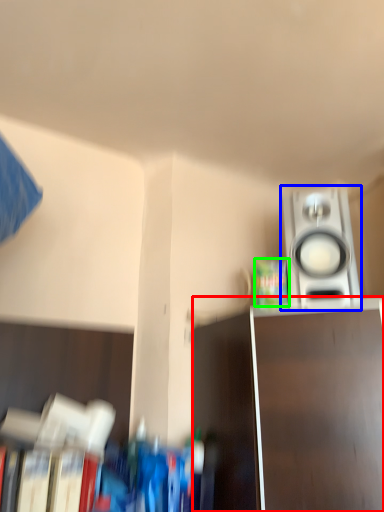
Question: Which object is the closest to the furniture (highlighted by a red box)? Choose among these: home appliance (highlighted by a blue box) or paperback book (highlighted by a green box).

Choices:
 (A) home appliance
 (B) paperback book

Answer: (A)